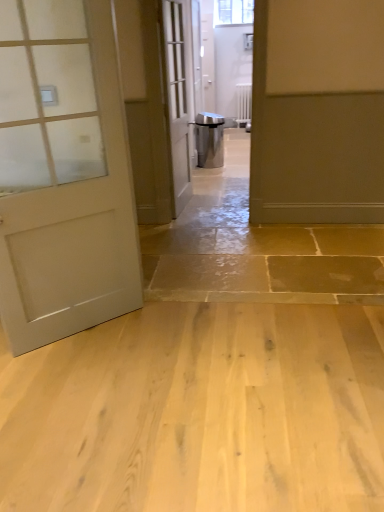
Question: Is matte white door at left, the third door viewed from the back, thinner than light brown wood flooring at center?

Choices:
 (A) yes
 (B) no

Answer: (A)

Question: Is matte white door at left, which is the 1th door from left to right, completely or partially outside of light brown wood flooring at center?

Choices:
 (A) yes
 (B) no

Answer: (A)

Question: Are matte white door at left, which is the 1th door from left to right, and light brown wood flooring at center located far from each other?

Choices:
 (A) no
 (B) yes

Answer: (A)

Question: Is matte white door at left, the first door viewed from the front, beside light brown wood flooring at center?

Choices:
 (A) no
 (B) yes

Answer: (A)

Question: Can you confirm if matte white door at left, which is the 1th door from left to right, is positioned to the left of light brown wood flooring at center?

Choices:
 (A) no
 (B) yes

Answer: (B)

Question: Is matte white door at left, the third door viewed from the back, in front of light brown wood flooring at center?

Choices:
 (A) yes
 (B) no

Answer: (B)

Question: Considering the relative sizes of white painted metal radiator at center and matte gray door at right, which is the first door from back to front, in the image provided, is white painted metal radiator at center shorter than matte gray door at right, which is the first door from back to front,?

Choices:
 (A) yes
 (B) no

Answer: (A)

Question: Is matte gray door at right, which is the first door from back to front, located within white painted metal radiator at center?

Choices:
 (A) yes
 (B) no

Answer: (B)

Question: Does white painted metal radiator at center come in front of matte gray door at right, which is the first door from back to front?

Choices:
 (A) no
 (B) yes

Answer: (A)

Question: Is white painted metal radiator at center to the left of matte gray door at right, arranged as the 1th door when viewed from the right, from the viewer's perspective?

Choices:
 (A) no
 (B) yes

Answer: (B)

Question: Does white painted metal radiator at center have a lesser width compared to matte gray door at right, which is the first door from back to front?

Choices:
 (A) no
 (B) yes

Answer: (B)

Question: Does white painted metal radiator at center have a larger size compared to matte gray door at right, the third door when ordered from front to back?

Choices:
 (A) yes
 (B) no

Answer: (B)

Question: From the image's perspective, is matte white door at left, the first door viewed from the front, on top of white glass door at center, arranged as the 2th door when viewed from the right?

Choices:
 (A) yes
 (B) no

Answer: (B)